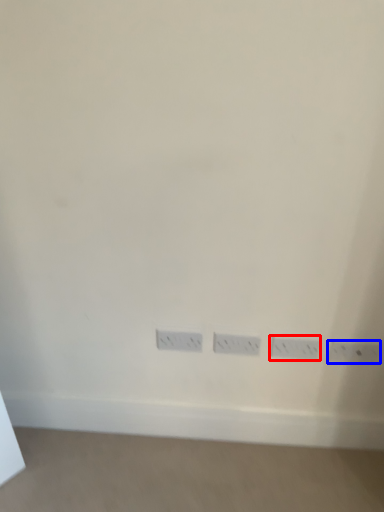
Question: Which object is closer to the camera taking this photo, power plugs and sockets (highlighted by a red box) or power plugs and sockets (highlighted by a blue box)?

Choices:
 (A) power plugs and sockets
 (B) power plugs and sockets

Answer: (B)